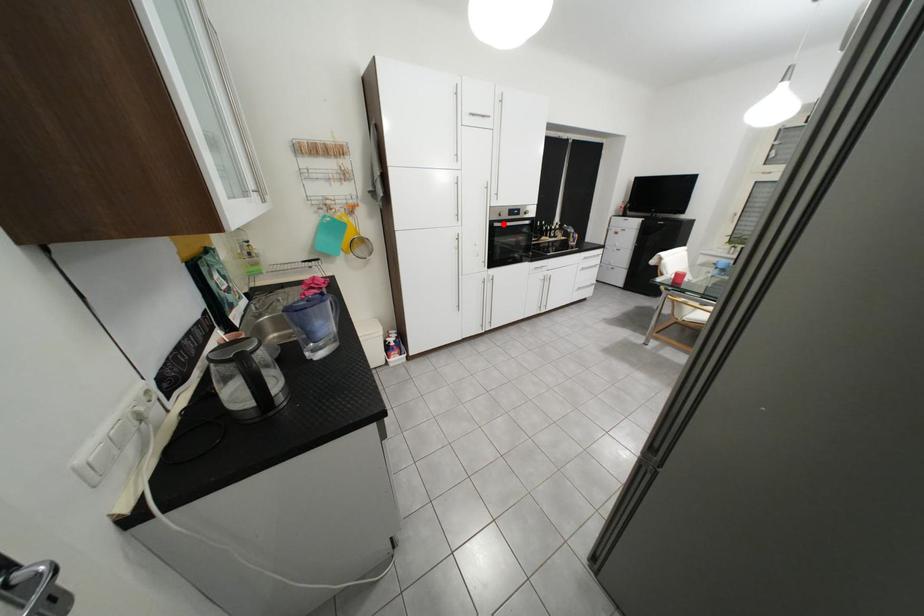
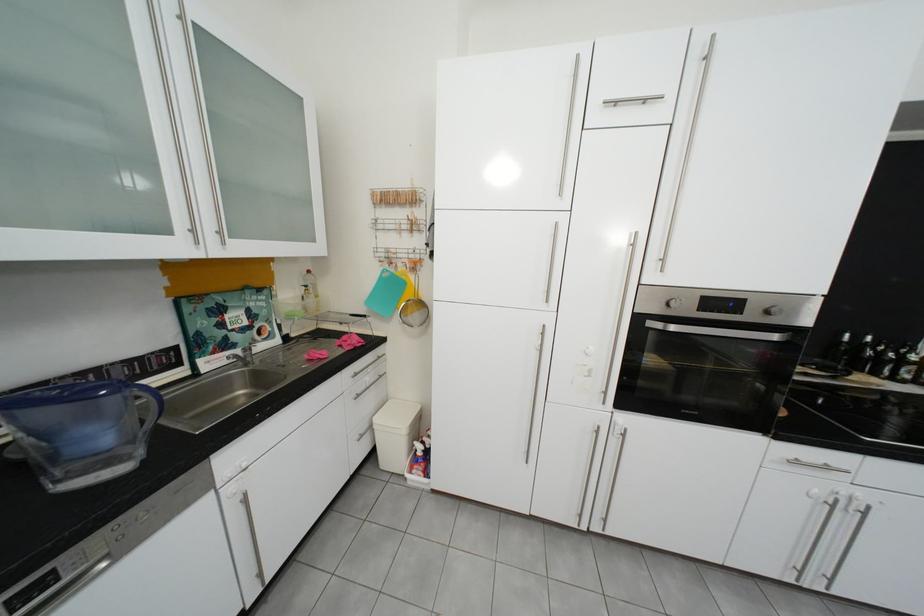
Locate, in the second image, the point that corresponds to the highlighted location in the first image.

(650, 320)